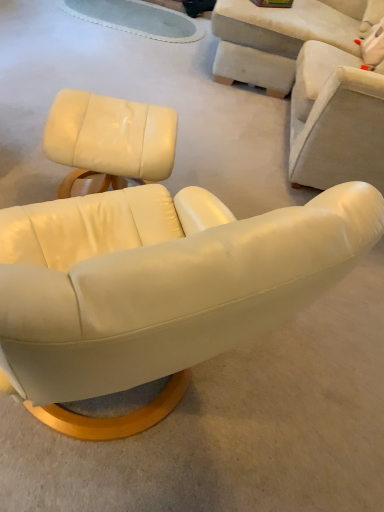
Question: Is matte white leather chair at center, the second chair viewed from the right, in front of or behind matte white leather ottoman at upper left, the 3th chair positioned from the right, in the image?

Choices:
 (A) front
 (B) behind

Answer: (A)

Question: Choose the correct answer: Is matte white leather chair at center, the second chair viewed from the right, inside matte white leather ottoman at upper left, placed as the first chair when sorted from left to right, or outside it?

Choices:
 (A) outside
 (B) inside

Answer: (A)

Question: Which object is the closest to the matte white leather chair at center, the second chair in the left-to-right sequence?

Choices:
 (A) matte white leather ottoman at upper left, the 3th chair positioned from the right
 (B) matte white armchair at upper right, the 3th chair viewed from the left

Answer: (A)

Question: Based on their relative distances, which object is farther from the matte white leather chair at center, the second chair viewed from the right?

Choices:
 (A) matte white leather ottoman at upper left, the 3th chair positioned from the right
 (B) matte white armchair at upper right, which appears as the first chair when viewed from the right

Answer: (B)